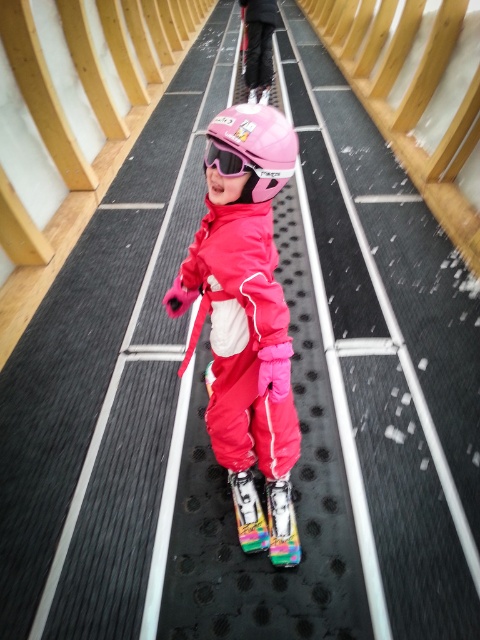
You are a photographer setting up for a photo shoot with the child in the scene. You need to position a light source to the left of the pink matte ski goggles at center so that it illuminates the matte black pants at center. Is the light placement possible without moving the goggles?

Yes, the light can be placed to the left of the pink matte ski goggles at center because the matte black pants at center are positioned to the right of the goggles, so placing the light to the goggles left would still allow light to reach the pants.

You are a photographer setting up for a photo shoot with the child wearing the matte pink snowsuit at center and holding the multicolored plastic ski at center. You need to ensure the ski is visible in the shot. Based on their sizes, should you position the ski higher or lower in the frame to make it noticeable?

The matte pink snowsuit at center is much taller than the multicolored plastic ski at center. To make the ski visible, position it higher in the frame so it stands out against the snowsuit.